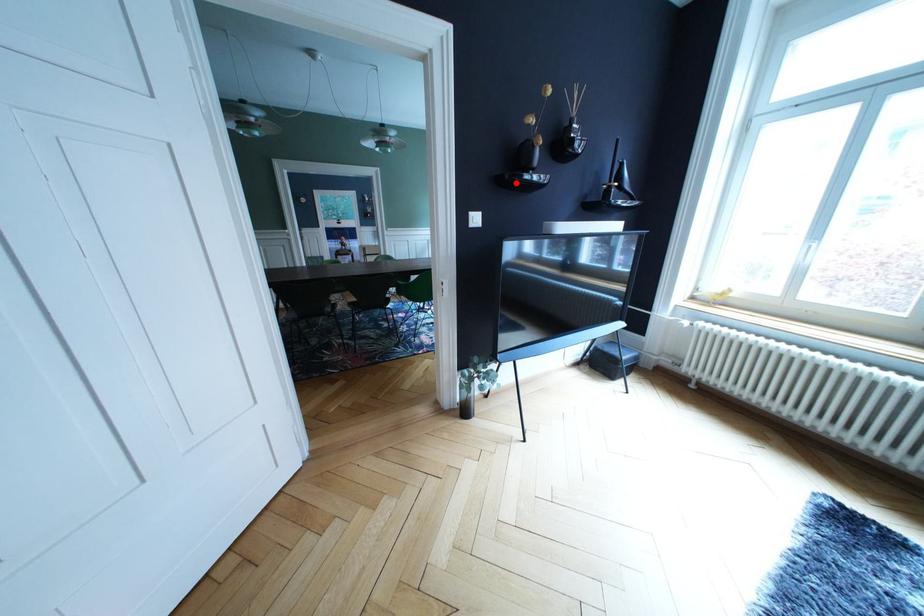
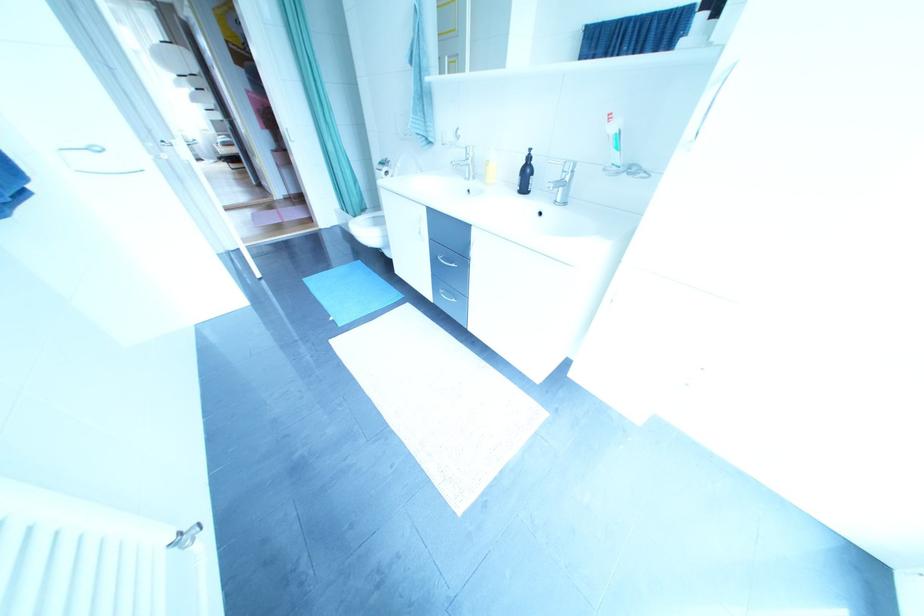
Question: I am providing you with two images of the same scene from different viewpoints. A red point is marked on the first image. At the location where the point appears in image 1, is it still visible in image 2?

Choices:
 (A) Yes
 (B) No

Answer: (B)